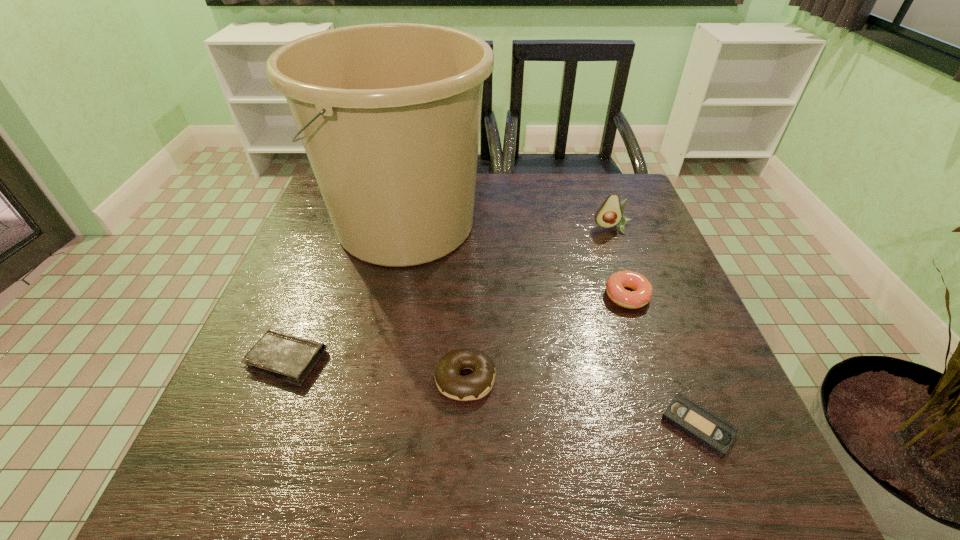
The height and width of the screenshot is (540, 960). I want to click on vacant space in between the second shortest object and the bucket, so click(x=347, y=292).

The height and width of the screenshot is (540, 960). I want to click on vacant space that's between the nearer doughnut and the second tallest object, so click(x=539, y=303).

The width and height of the screenshot is (960, 540). Find the location of `unoccupied area between the farther doughnut and the left doughnut`. unoccupied area between the farther doughnut and the left doughnut is located at coordinates (546, 337).

Find the location of a particular element. This screenshot has width=960, height=540. blank region between the tallest object and the avocado is located at coordinates (510, 226).

The width and height of the screenshot is (960, 540). I want to click on free spot between the diary and the fifth shortest object, so click(x=449, y=294).

Find the location of `object that stands as the closest to the farther doughnut`. object that stands as the closest to the farther doughnut is located at coordinates (609, 214).

The height and width of the screenshot is (540, 960). I want to click on object that stands as the closest to the right doughnut, so click(x=609, y=214).

The image size is (960, 540). In order to click on free point that satisfies the following two spatial constraints: 1. on the front side of the nearer doughnut; 2. on the left side of the videotape in this screenshot , I will do `click(464, 426)`.